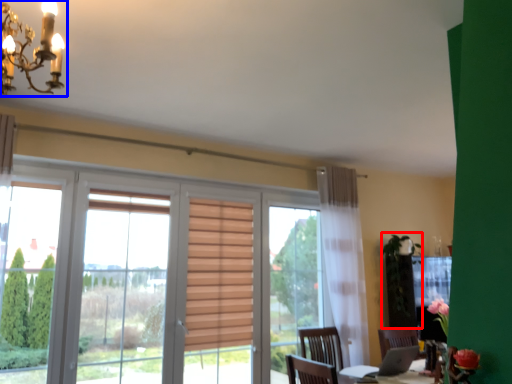
Question: Among these objects, which one is farthest to the camera, plant (highlighted by a red box) or light fixture (highlighted by a blue box)?

Choices:
 (A) plant
 (B) light fixture

Answer: (A)